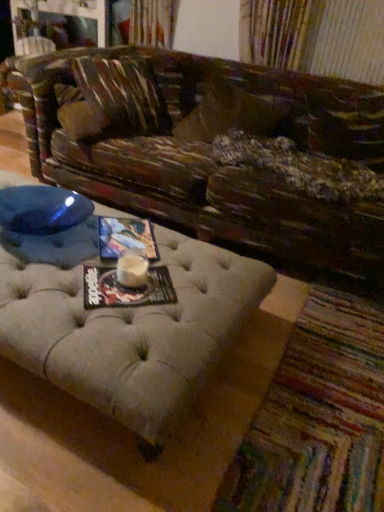
Image resolution: width=384 pixels, height=512 pixels. What do you see at coordinates (317, 417) in the screenshot? I see `beige tufted ottoman at lower center` at bounding box center [317, 417].

How much space does matte paper magazine at center, which ranks as the 2th magazine in front-to-back order, occupy vertically?

1.29 inches.

This screenshot has width=384, height=512. Identify the location of beige tufted ottoman at lower center. (317, 417).

Is leather-like brown pillow at center located within beige tufted ottoman at lower center?

No, leather-like brown pillow at center is not inside beige tufted ottoman at lower center.

From the image's perspective, is beige tufted ottoman at lower center over leather-like brown pillow at center?

No, from the image's perspective, beige tufted ottoman at lower center is not above leather-like brown pillow at center.

The height and width of the screenshot is (512, 384). What are the coordinates of `mat located below the leather-like brown pillow at center (from the image's perspective)` in the screenshot? It's located at (317, 417).

Is beige tufted ottoman at lower center bigger than leather-like brown pillow at center?

Incorrect, beige tufted ottoman at lower center is not larger than leather-like brown pillow at center.

How much distance is there between matte paper magazine at center, which ranks as the 2th magazine in front-to-back order, and leather-like brown pillow at center?

38.57 inches.

Which point is more distant from viewer, [137,228] or [203,102]?

Positioned behind is point [203,102].

From a real-world perspective, which object rests below the other?

matte paper magazine at center, which is counted as the 2th magazine, starting from the bottom, is physically lower.

Which of these two, matte paper magazine at center, positioned as the 1th magazine in back-to-front order, or leather-like brown pillow at center, is thinner?

matte paper magazine at center, positioned as the 1th magazine in back-to-front order, is thinner.

From a real-world perspective, which is physically above, leather-like brown pillow at center or matte paper magazine at center, positioned as the second magazine in top-to-bottom order?

leather-like brown pillow at center, from a real-world perspective.

Which object is thinner, leather-like brown pillow at center or matte paper magazine at center, the 2th magazine viewed from the back?

matte paper magazine at center, the 2th magazine viewed from the back.

At what (x,y) coordinates should I click in order to perform the action: click on pillow that is above the matte paper magazine at center, the 2th magazine viewed from the back (from a real-world perspective). Please return your answer as a coordinate pair (x, y). The width and height of the screenshot is (384, 512). Looking at the image, I should click on pyautogui.click(x=231, y=113).

Does point (241, 129) come in front of point (153, 287)?

No, it is not.

Does leather-like brown pillow at center have a lesser width compared to beige tufted ottoman at lower center?

Yes, leather-like brown pillow at center is thinner than beige tufted ottoman at lower center.

Locate an element on the screen. The image size is (384, 512). pillow on the left side of beige tufted ottoman at lower center is located at coordinates pos(231,113).

Looking at this image, from a real-world perspective, is leather-like brown pillow at center physically below beige tufted ottoman at lower center?

No.

How many degrees apart are the facing directions of leather-like brown pillow at center and beige tufted ottoman at lower center?

The facing directions of leather-like brown pillow at center and beige tufted ottoman at lower center are 98.9 degrees apart.

From the image's perspective, which one is positioned lower, matte paper magazine at center, marked as the first magazine in a front-to-back arrangement, or matte paper magazine at center, the 1th magazine when ordered from top to bottom?

matte paper magazine at center, marked as the first magazine in a front-to-back arrangement.

Which is correct: matte paper magazine at center, the 2th magazine viewed from the back, is inside matte paper magazine at center, the 1th magazine when ordered from top to bottom, or outside of it?

matte paper magazine at center, the 2th magazine viewed from the back, cannot be found inside matte paper magazine at center, the 1th magazine when ordered from top to bottom.

Considering the positions of point (100, 306) and point (99, 238), is point (100, 306) closer or farther from the camera than point (99, 238)?

Clearly, point (100, 306) is closer to the camera than point (99, 238).

In the image, there is a matte paper magazine at center, the 1th magazine when ordered from top to bottom. Find the location of `magazine below it (from the image's perspective)`. magazine below it (from the image's perspective) is located at coordinates (126, 288).

Is leather-like brown pillow at center wider or thinner than matte paper magazine at center, which ranks as the 2th magazine in front-to-back order?

Considering their sizes, leather-like brown pillow at center looks broader than matte paper magazine at center, which ranks as the 2th magazine in front-to-back order.

From a real-world perspective, which is physically below, leather-like brown pillow at center or matte paper magazine at center, which ranks as the 2th magazine in front-to-back order?

From a 3D spatial view, matte paper magazine at center, which ranks as the 2th magazine in front-to-back order, is below.

Can you confirm if leather-like brown pillow at center is positioned to the right of matte paper magazine at center, which is counted as the 2th magazine, starting from the bottom?

Indeed, leather-like brown pillow at center is positioned on the right side of matte paper magazine at center, which is counted as the 2th magazine, starting from the bottom.

Considering the relative sizes of leather-like brown pillow at center and matte paper magazine at center, the 1th magazine when ordered from top to bottom, in the image provided, is leather-like brown pillow at center taller than matte paper magazine at center, the 1th magazine when ordered from top to bottom,?

Indeed, leather-like brown pillow at center has a greater height compared to matte paper magazine at center, the 1th magazine when ordered from top to bottom.

Which is behind, point (140, 305) or point (286, 408)?

Point (286, 408)

Considering the sizes of objects matte paper magazine at center, which is counted as the first magazine, starting from the bottom, and beige tufted ottoman at lower center in the image provided, who is thinner, matte paper magazine at center, which is counted as the first magazine, starting from the bottom, or beige tufted ottoman at lower center?

matte paper magazine at center, which is counted as the first magazine, starting from the bottom, is thinner.

From a real-world perspective, is matte paper magazine at center, the 2th magazine viewed from the back, on top of beige tufted ottoman at lower center?

Yes, from a real-world perspective, matte paper magazine at center, the 2th magazine viewed from the back, is on top of beige tufted ottoman at lower center.

The image size is (384, 512). I want to click on pillow above the beige tufted ottoman at lower center (from a real-world perspective), so click(231, 113).

The height and width of the screenshot is (512, 384). I want to click on the 1st magazine below the leather-like brown pillow at center (from the image's perspective), so click(126, 238).

Looking at the image, which one is located further to matte paper magazine at center, positioned as the second magazine in top-to-bottom order, leather-like brown pillow at center or matte paper magazine at center, positioned as the 1th magazine in back-to-front order?

leather-like brown pillow at center is positioned further to the anchor matte paper magazine at center, positioned as the second magazine in top-to-bottom order.

Considering their positions, is beige tufted ottoman at lower center positioned further to matte paper magazine at center, the 1th magazine when ordered from top to bottom, than leather-like brown pillow at center?

Among the two, leather-like brown pillow at center is located further to matte paper magazine at center, the 1th magazine when ordered from top to bottom.

Which object lies further to the anchor point beige tufted ottoman at lower center, matte paper magazine at center, which ranks as the 2th magazine in front-to-back order, or leather-like brown pillow at center?

Based on the image, leather-like brown pillow at center appears to be further to beige tufted ottoman at lower center.

Based on the photo, which object lies further to the anchor point leather-like brown pillow at center, matte paper magazine at center, which is counted as the 2th magazine, starting from the bottom, or beige tufted ottoman at lower center?

beige tufted ottoman at lower center is positioned further to the anchor leather-like brown pillow at center.

Estimate the real-world distances between objects in this image. Which object is further from matte paper magazine at center, positioned as the second magazine in top-to-bottom order, beige tufted ottoman at lower center or leather-like brown pillow at center?

The object further to matte paper magazine at center, positioned as the second magazine in top-to-bottom order, is leather-like brown pillow at center.

Considering their positions, is leather-like brown pillow at center positioned further to matte paper magazine at center, which ranks as the 2th magazine in front-to-back order, than beige tufted ottoman at lower center?

Based on the image, leather-like brown pillow at center appears to be further to matte paper magazine at center, which ranks as the 2th magazine in front-to-back order.

Which object lies nearer to the anchor point leather-like brown pillow at center, beige tufted ottoman at lower center or matte paper magazine at center, which ranks as the 2th magazine in front-to-back order?

matte paper magazine at center, which ranks as the 2th magazine in front-to-back order, is closer to leather-like brown pillow at center.

When comparing their distances from matte paper magazine at center, positioned as the 1th magazine in back-to-front order, does leather-like brown pillow at center or matte paper magazine at center, which is counted as the first magazine, starting from the bottom, seem further?

leather-like brown pillow at center.

Identify the location of magazine between leather-like brown pillow at center and matte paper magazine at center, the 2th magazine viewed from the back, vertically. This screenshot has height=512, width=384. (126, 238).

This screenshot has height=512, width=384. Find the location of `magazine situated between matte paper magazine at center, which ranks as the 2th magazine in front-to-back order, and beige tufted ottoman at lower center from left to right`. magazine situated between matte paper magazine at center, which ranks as the 2th magazine in front-to-back order, and beige tufted ottoman at lower center from left to right is located at coordinates 126,288.